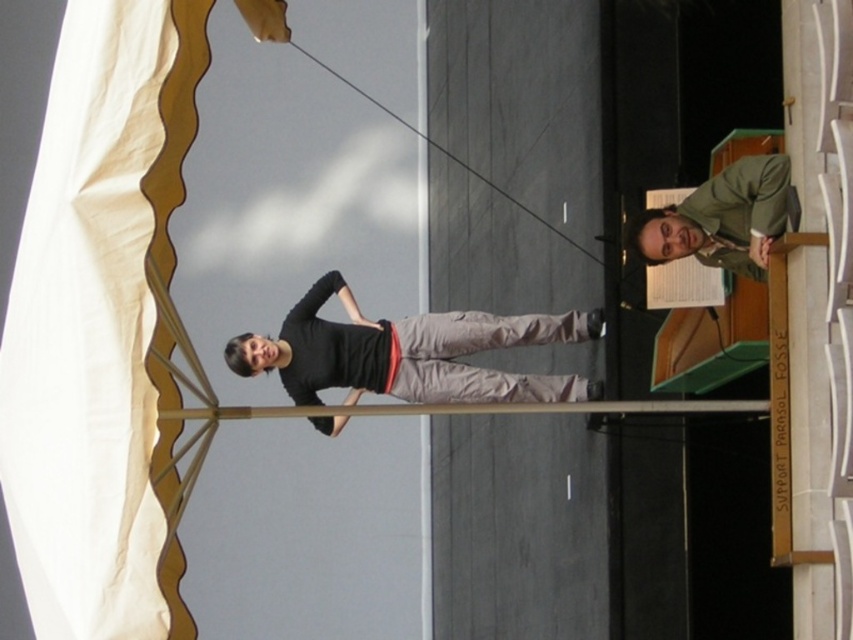
You are a photographer setting up for a photoshoot. You need to position a spotlight so that it illuminates both the black matte shirt at center and the green matte jacket at upper right equally. Based on their positions, where should you place the spotlight relative to the two subjects?

The black matte shirt at center is to the left of the green matte jacket at upper right. To equally illuminate both, the spotlight should be placed directly between them, ensuring both are within its coverage area.

You are directing a play and need to adjust the lighting. The spotlight can only illuminate objects closer to the front. Which character should you focus on, the one wearing the black matte shirt at center or the green matte jacket at upper right?

The black matte shirt at center is closer to the viewer, so the spotlight should focus on the black matte shirt at center since it is nearer and would be illuminated properly by the spotlight.

You are a photographer setting up for a photoshoot. You need to position a spotlight at point (x=408, y=353). What object should the spotlight illuminate?

The spotlight at point (x=408, y=353) should illuminate the black matte shirt at center.